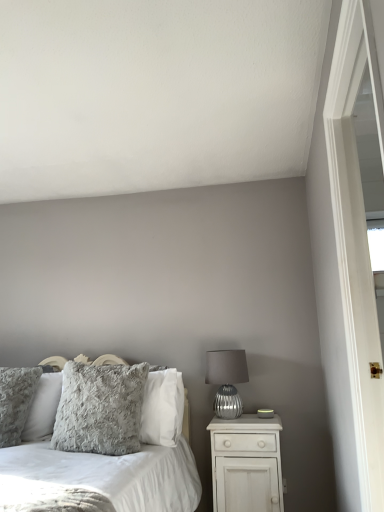
Question: Considering the relative sizes of fluffy gray pillow at left, arranged as the second pillow when viewed from the right, and white matte nightstand at lower right in the image provided, is fluffy gray pillow at left, arranged as the second pillow when viewed from the right, smaller than white matte nightstand at lower right?

Choices:
 (A) no
 (B) yes

Answer: (B)

Question: From the image's perspective, is fluffy gray pillow at left, arranged as the second pillow when viewed from the right, above white matte nightstand at lower right?

Choices:
 (A) no
 (B) yes

Answer: (B)

Question: Is fluffy gray pillow at left, arranged as the second pillow when viewed from the right, in front of white matte nightstand at lower right?

Choices:
 (A) yes
 (B) no

Answer: (B)

Question: From the image's perspective, is fluffy gray pillow at left, arranged as the second pillow when viewed from the right, below white matte nightstand at lower right?

Choices:
 (A) no
 (B) yes

Answer: (A)

Question: Is the surface of fluffy gray pillow at left, which is counted as the 1th pillow, starting from the left, in direct contact with white matte nightstand at lower right?

Choices:
 (A) yes
 (B) no

Answer: (B)

Question: Is fluffy gray pillow at center, the first pillow when ordered from right to left, inside the boundaries of fluffy gray pillow at left, arranged as the second pillow when viewed from the right, or outside?

Choices:
 (A) outside
 (B) inside

Answer: (A)

Question: From the image's perspective, is fluffy gray pillow at center, the first pillow when ordered from right to left, located above or below fluffy gray pillow at left, arranged as the second pillow when viewed from the right?

Choices:
 (A) above
 (B) below

Answer: (A)

Question: Looking at their shapes, would you say fluffy gray pillow at center, the second pillow when ordered from left to right, is wider or thinner than fluffy gray pillow at left, which is counted as the 1th pillow, starting from the left?

Choices:
 (A) wide
 (B) thin

Answer: (B)

Question: Considering the positions of fluffy gray pillow at center, the first pillow when ordered from right to left, and fluffy gray pillow at left, which is counted as the 1th pillow, starting from the left, in the image, is fluffy gray pillow at center, the first pillow when ordered from right to left, bigger or smaller than fluffy gray pillow at left, which is counted as the 1th pillow, starting from the left,?

Choices:
 (A) big
 (B) small

Answer: (A)

Question: Considering the relative positions of fluffy gray pillow at left, arranged as the second pillow when viewed from the right, and white matte nightstand at lower right in the image provided, is fluffy gray pillow at left, arranged as the second pillow when viewed from the right, to the left or to the right of white matte nightstand at lower right?

Choices:
 (A) left
 (B) right

Answer: (A)

Question: Based on their sizes in the image, would you say fluffy gray pillow at left, arranged as the second pillow when viewed from the right, is bigger or smaller than white matte nightstand at lower right?

Choices:
 (A) small
 (B) big

Answer: (A)

Question: In terms of height, does fluffy gray pillow at left, arranged as the second pillow when viewed from the right, look taller or shorter compared to white matte nightstand at lower right?

Choices:
 (A) tall
 (B) short

Answer: (A)

Question: From a real-world perspective, is fluffy gray pillow at left, arranged as the second pillow when viewed from the right, positioned above or below white matte nightstand at lower right?

Choices:
 (A) above
 (B) below

Answer: (A)

Question: Do you think white wooden screen door at right is within matte silver glass table lamp at right, or outside of it?

Choices:
 (A) outside
 (B) inside

Answer: (A)

Question: In the image, is white wooden screen door at right on the left side or the right side of matte silver glass table lamp at right?

Choices:
 (A) right
 (B) left

Answer: (A)